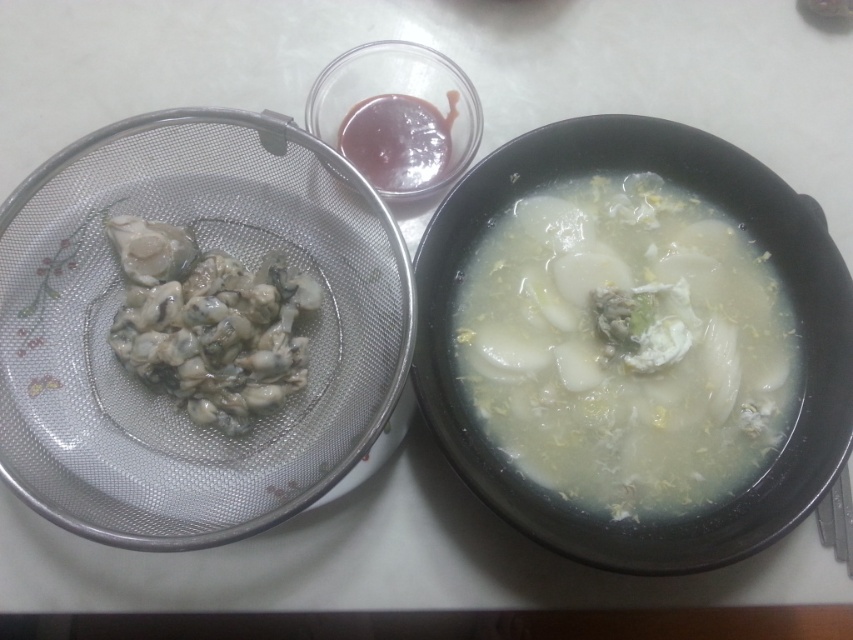
You are a food critic trying to describe the presentation of this dish. Which item, the grayish translucent oyster at left or the smooth glossy sauce at upper center, is taller in height?

The grayish translucent oyster at left has a greater height compared to the smooth glossy sauce at upper center.

You are a food critic evaluating the presentation of this dish. The oyster and sauce are key elements. Which of the two items, the grayish translucent oyster at left or the smooth glossy sauce at upper center, is wider in size?

The grayish translucent oyster at left is wider than the smooth glossy sauce at upper center according to the description provided.

You are a food critic trying to describe the arrangement of the meal. Which item is larger in size between the white translucent soup at center and the grayish translucent oyster at left?

The white translucent soup at center is bigger than the grayish translucent oyster at left.